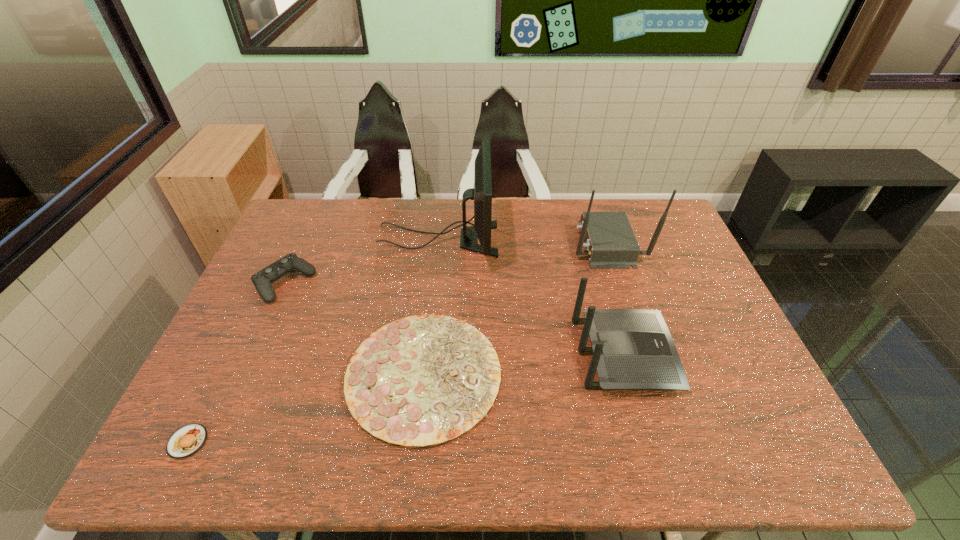
Identify the location of vacant area situated 0.080m on the back of the taller router to connect cables. This screenshot has height=540, width=960. (546, 244).

What are the coordinates of `vacant region located on the front-facing side of the third tallest object` in the screenshot? It's located at (717, 354).

You are a GUI agent. You are given a task and a screenshot of the screen. Output one action in this format:
    pyautogui.click(x=<x>, y=<y>)
    Task: Click on the free space located on the back of the fourth tallest object
    Image resolution: width=960 pixels, height=540 pixels.
    Given the screenshot: What is the action you would take?
    pyautogui.click(x=313, y=221)

I want to click on free space located 0.130m on the back of the pizza, so click(x=433, y=283).

Locate an element on the screen. This screenshot has width=960, height=540. vacant space located 0.100m on the back of the patty is located at coordinates (215, 386).

Where is `computer monitor present at the far edge`? computer monitor present at the far edge is located at coordinates (482, 192).

The height and width of the screenshot is (540, 960). In order to click on router that is at the far edge in this screenshot , I will do `click(610, 242)`.

You are a GUI agent. You are given a task and a screenshot of the screen. Output one action in this format:
    pyautogui.click(x=<x>, y=<y>)
    Task: Click on the pizza present at the near edge
    Image resolution: width=960 pixels, height=540 pixels.
    Given the screenshot: What is the action you would take?
    pyautogui.click(x=422, y=380)

This screenshot has width=960, height=540. In order to click on patty located at the near edge in this screenshot , I will do `click(186, 441)`.

The height and width of the screenshot is (540, 960). What are the coordinates of `control situated at the left edge` in the screenshot? It's located at (262, 280).